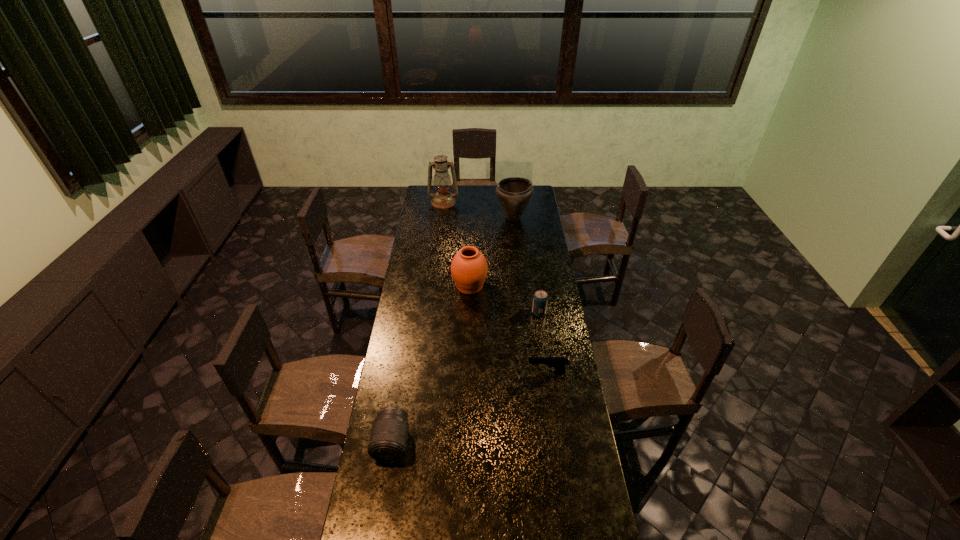
Identify the location of vacant space that satisfies the following two spatial constraints: 1. on the front-facing side of the fifth farthest object; 2. on the surface of the nearest object. (558, 443).

I want to click on free location that satisfies the following two spatial constraints: 1. on the front side of the pop soda; 2. on the right side of the oil lamp, so click(430, 313).